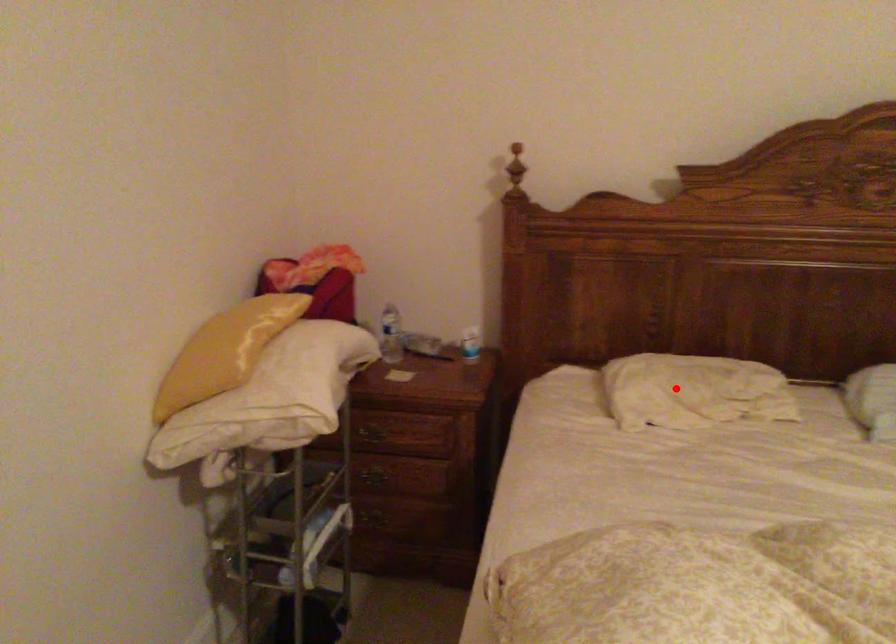
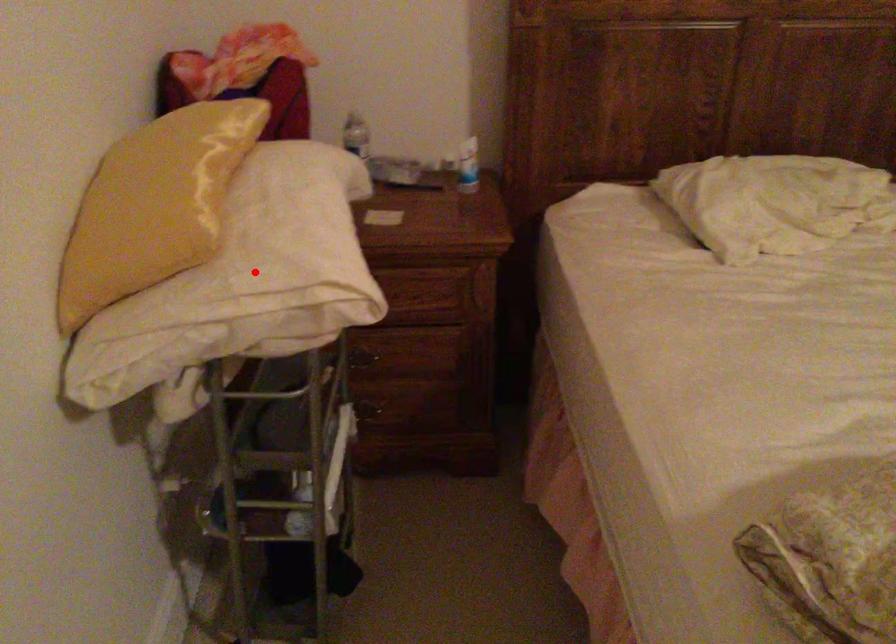
I am providing you with two images of the same scene from different viewpoints. A red point is marked on the first image and another point is marked on the second image. Is the red point in image1 aligned with the point shown in image2?

No